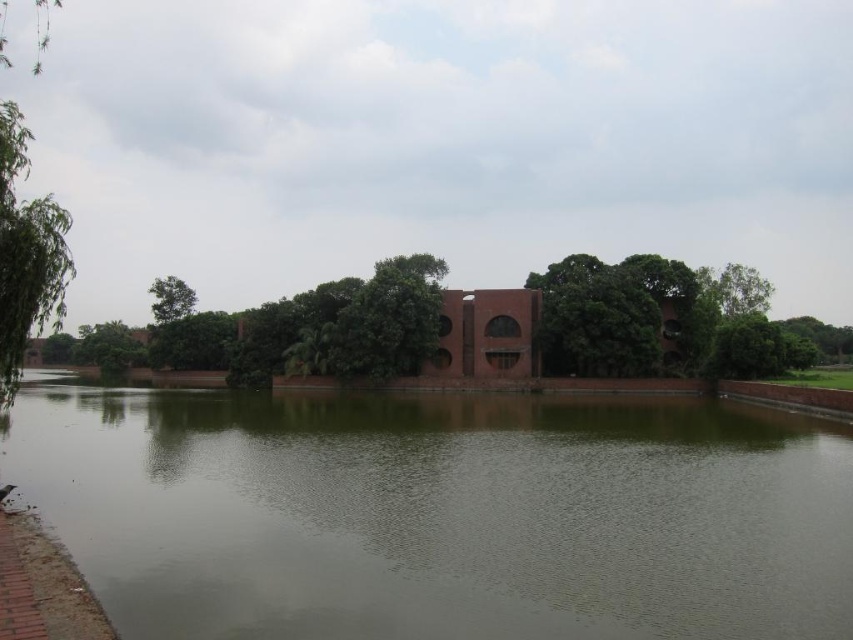
You are planning to take a photo of the brick structure in the middle ground. To ensure both the green leafy tree at center and the green leafy tree at upper left are visible in the frame, which tree should you position closer to the edge of the photo?

You should position the green leafy tree at upper left closer to the edge of the photo because it is narrower than the green leafy tree at center, which is wider and needs more space in the frame.

You are an architect designing a new garden layout and want to place a statue between the green leafy tree at upper right and the green leafy tree at upper left. Which tree should the statue be closer to if you want it to appear balanced?

The statue should be closer to the green leafy tree at upper left because it is smaller than the green leafy tree at upper right, creating a balanced visual weight.